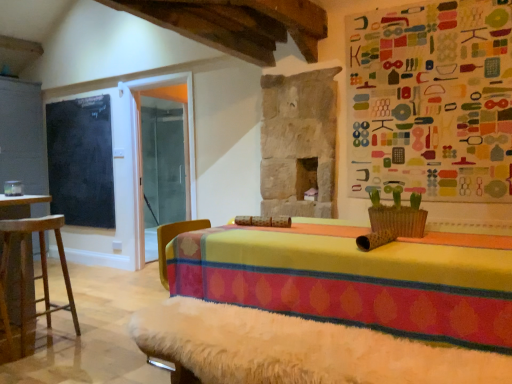
In order to click on free spot in front of wooden stool at left in this screenshot , I will do `click(34, 363)`.